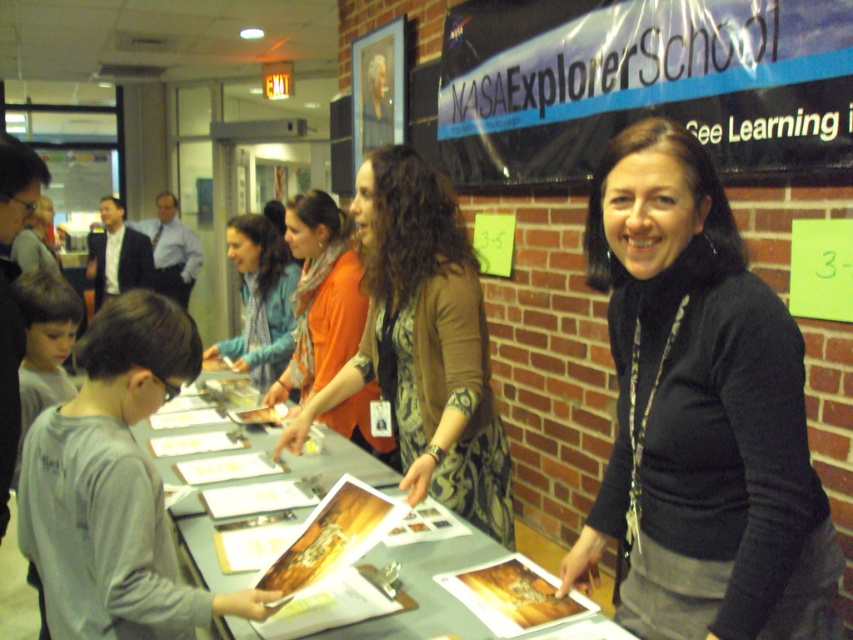
Is point (625, 92) positioned after point (372, 452)?

That is True.

Identify the location of blue plastic banner at upper center. (643, 83).

Measure the distance between black sweater at center and camera.

They are 1.13 meters apart.

Image resolution: width=853 pixels, height=640 pixels. What do you see at coordinates (700, 413) in the screenshot?
I see `black sweater at center` at bounding box center [700, 413].

Locate an element on the screen. This screenshot has height=640, width=853. black sweater at center is located at coordinates (700, 413).

Between brown textured sweater at center and green paper at center, which one appears on the right side from the viewer's perspective?

green paper at center

Which is in front, point (409, 252) or point (485, 266)?

Point (409, 252) is in front.

Which is in front, point (425, 358) or point (476, 220)?

Point (425, 358)

Where is `brown textured sweater at center`? The width and height of the screenshot is (853, 640). brown textured sweater at center is located at coordinates (422, 342).